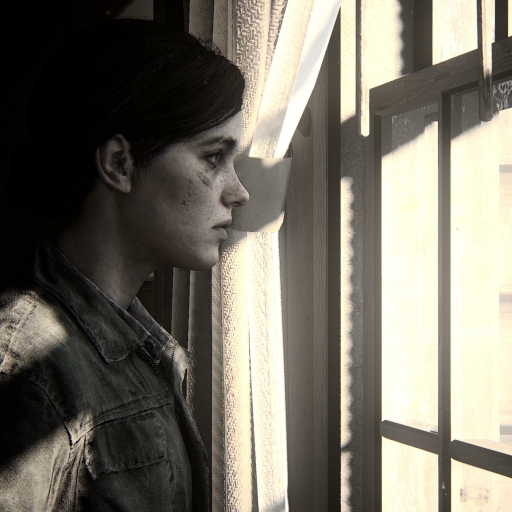
You are a GUI agent. You are given a task and a screenshot of the screen. Output one action in this format:
    pyautogui.click(x=<x>, y=<y>)
    Task: Click on the band that holds the curtains back
    Image resolution: width=512 pixels, height=512 pixels.
    Given the screenshot: What is the action you would take?
    pyautogui.click(x=276, y=188)